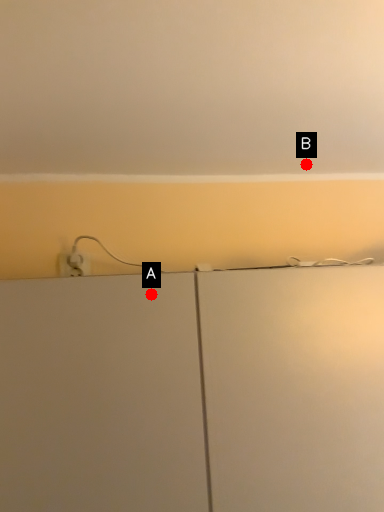
Question: Two points are circled on the image, labeled by A and B beside each circle. Which point is farther to the camera?

Choices:
 (A) A is further
 (B) B is further

Answer: (B)